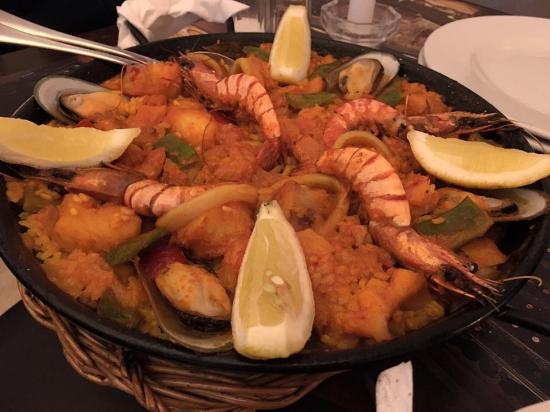
I want to click on spoon, so click(91, 52).